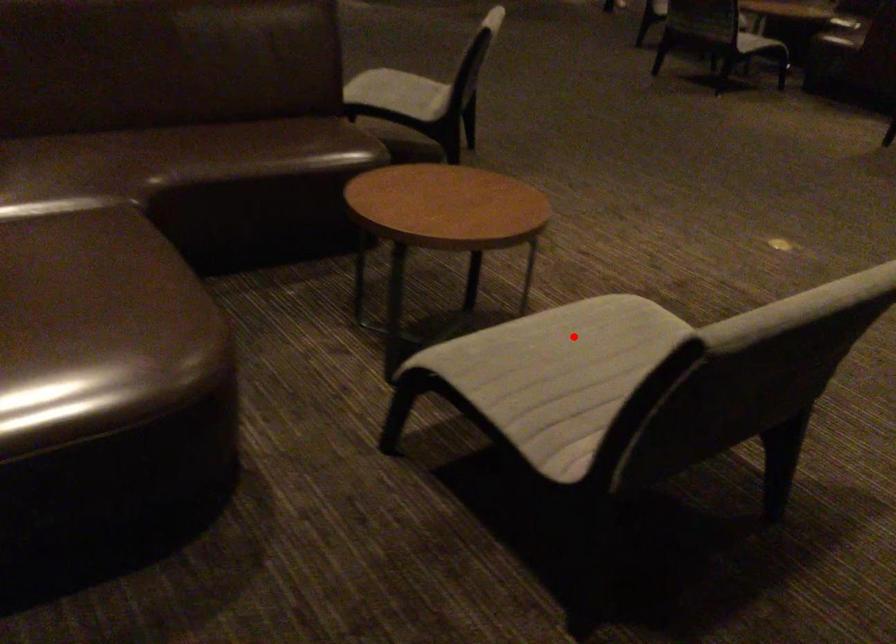
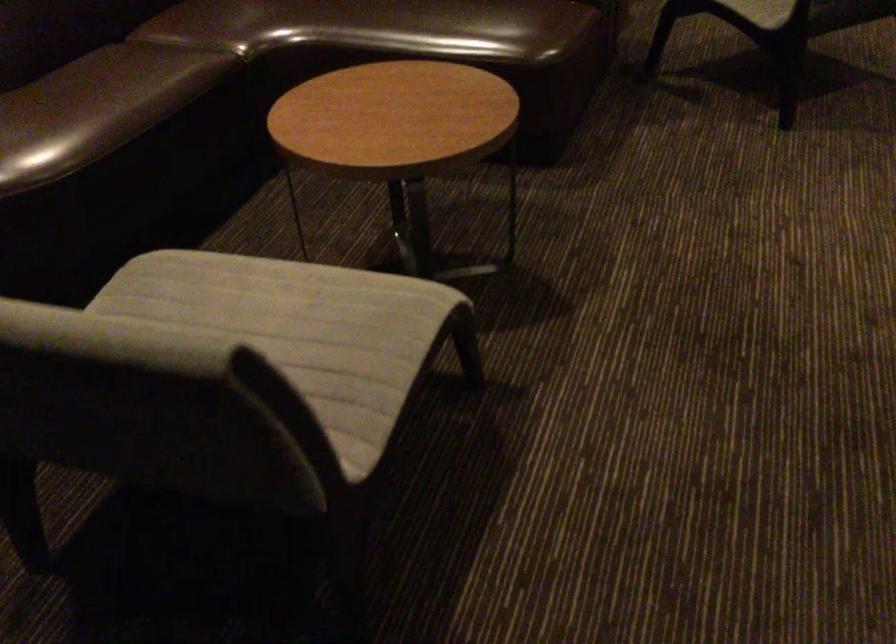
Locate, in the second image, the point that corresponds to the highlighted location in the first image.

(280, 299)